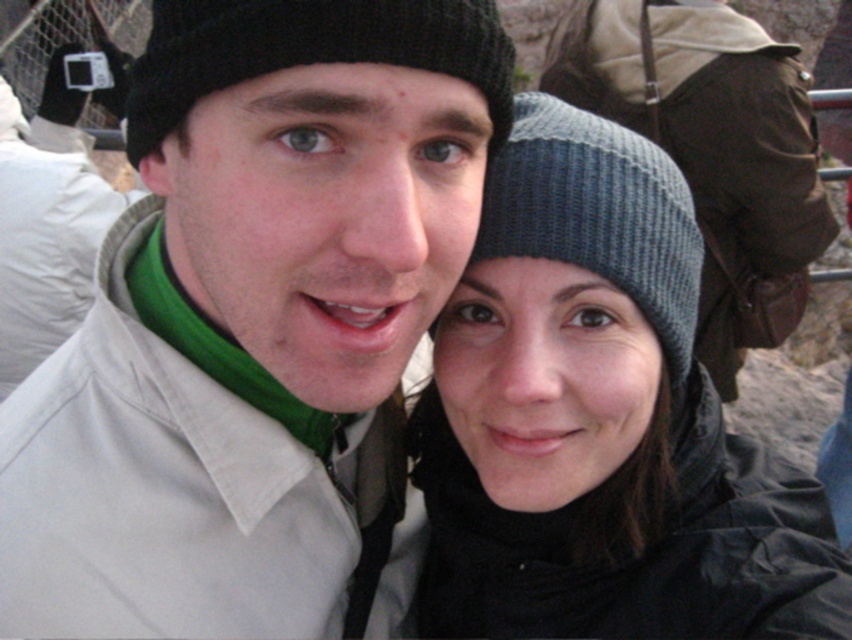
Question: Estimate the real-world distances between objects in this image. Which object is farther from the black knit hat at upper center?

Choices:
 (A) knitted wool beanie at center
 (B) gray knit beanie at upper center

Answer: (B)

Question: Is knitted wool beanie at center to the right of black knit hat at upper center from the viewer's perspective?

Choices:
 (A) no
 (B) yes

Answer: (B)

Question: Which of the following is the closest to the observer?

Choices:
 (A) (799, 186)
 (B) (406, 20)
 (C) (551, 296)

Answer: (B)

Question: Can you confirm if knitted wool beanie at center is bigger than black knit hat at upper center?

Choices:
 (A) no
 (B) yes

Answer: (B)

Question: Is knitted wool beanie at center smaller than gray knit beanie at upper center?

Choices:
 (A) no
 (B) yes

Answer: (B)

Question: Which of the following is the farthest from the observer?

Choices:
 (A) (292, 29)
 (B) (711, 275)
 (C) (629, 422)

Answer: (B)